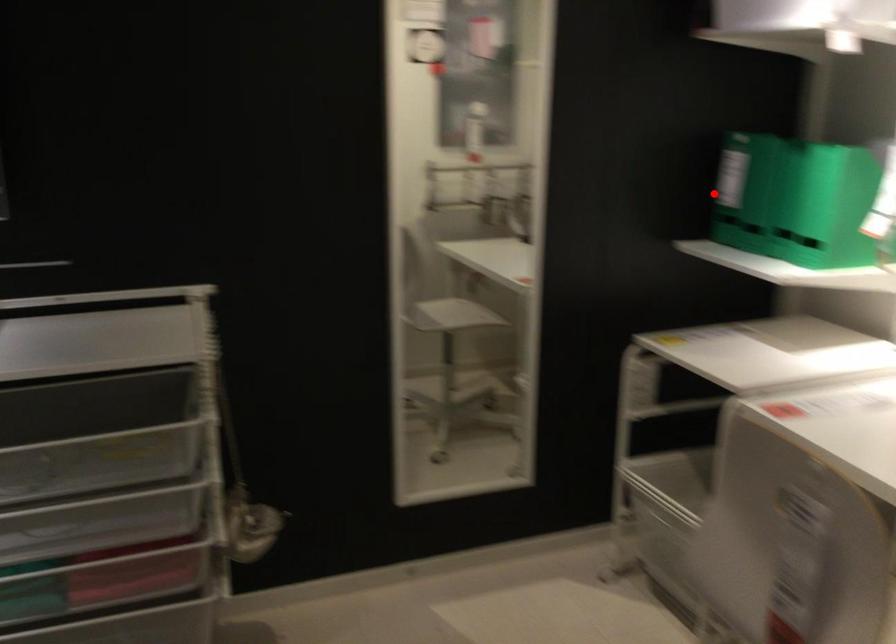
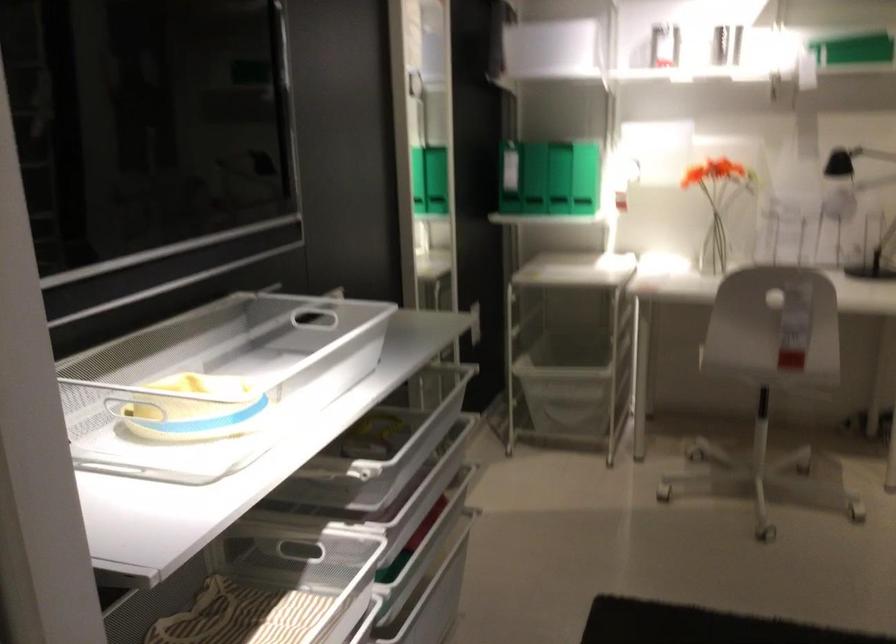
Question: I am providing you with two images of the same scene from different viewpoints. Image1 has a red point marked. In image2, the corresponding 3D location appears at what relative position? Reply with the corresponding letter.

Choices:
 (A) Closer
 (B) Farther

Answer: (B)